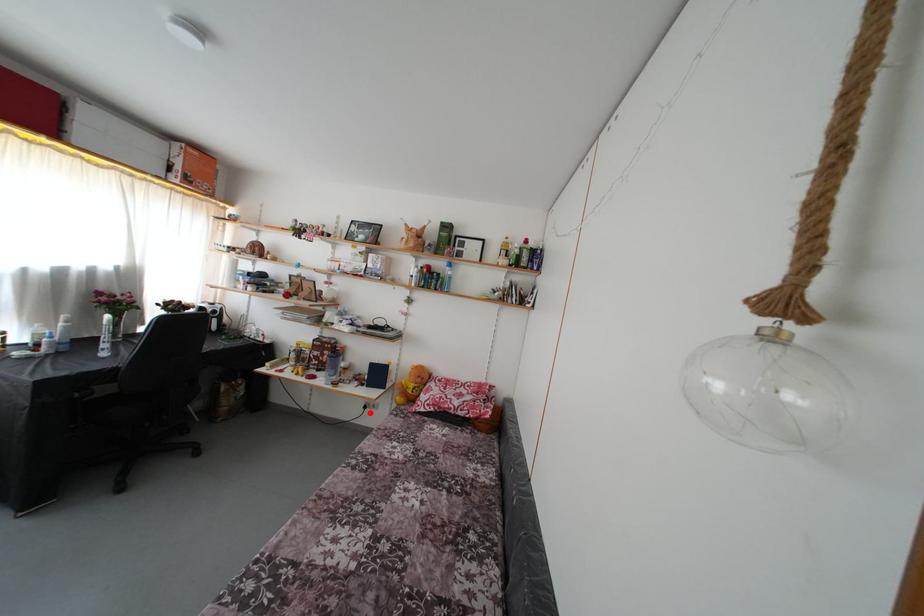
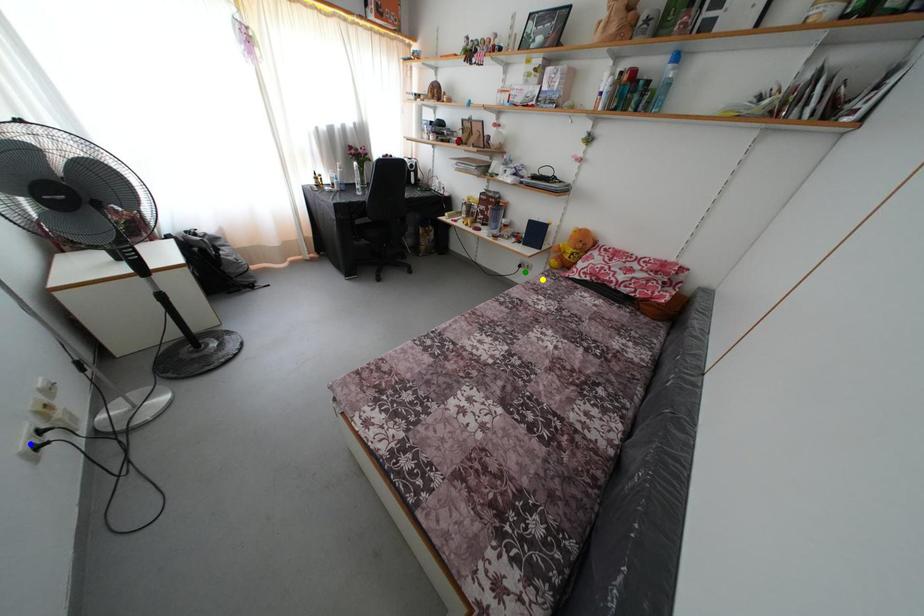
Question: I am providing you with two images of the same scene from different viewpoints. A red point is marked on the first image. You are given multiple points on the second image. Which point in image 2 represents the same 3d spot as the red point in image 1?

Choices:
 (A) green point
 (B) yellow point
 (C) blue point

Answer: (A)